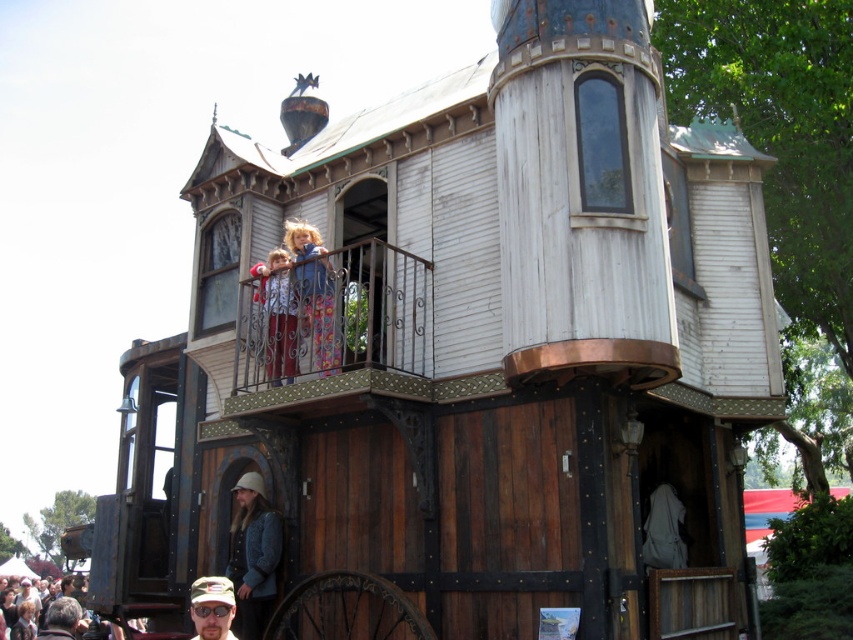
You are an architect designing a miniature model of this structure. You need to ensure that the white wrought iron balcony at upper center and the denim jacket at lower center are scaled correctly. Which object should be made larger in the model to maintain the scene proportions?

The white wrought iron balcony at upper center should be made larger in the model since it is larger in size than the denim jacket at lower center in the original scene.

You are standing in front of the whimsical multi tiered house. You see the white wrought iron balcony at upper center and the denim jacket at lower center. Which object is nearer to you?

The white wrought iron balcony at upper center is closer to the viewer than the denim jacket at lower center.